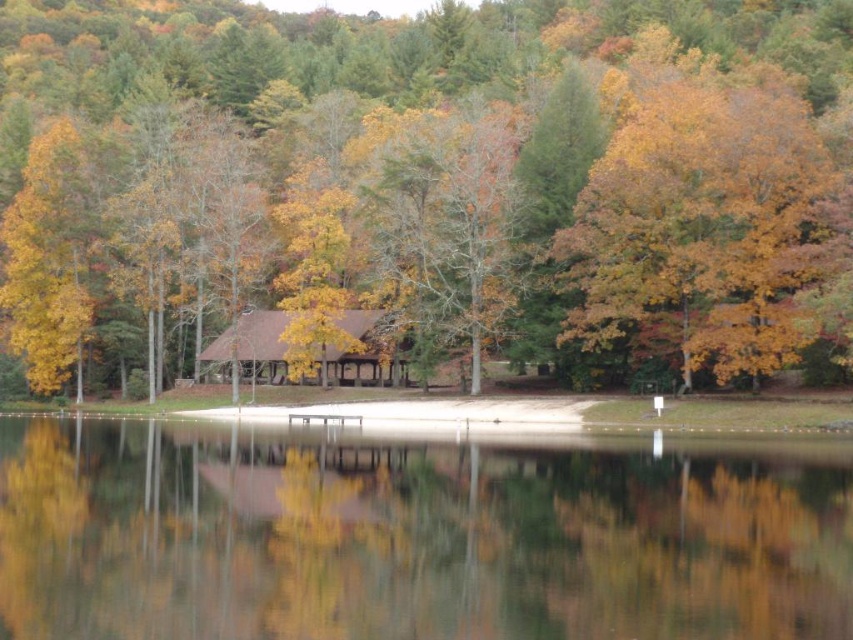
Question: Can you confirm if yellow matte tree at center is smaller than brown wooden cabin at center?

Choices:
 (A) no
 (B) yes

Answer: (A)

Question: Which object appears farthest from the camera in this image?

Choices:
 (A) yellow matte tree at center
 (B) transparent glass water at center
 (C) golden yellow leaves at upper right

Answer: (C)

Question: Which point is farther from the camera taking this photo?

Choices:
 (A) (334, 83)
 (B) (321, 541)
 (C) (756, 364)
 (D) (277, 323)

Answer: (A)

Question: Which point is farther to the camera?

Choices:
 (A) (83, 200)
 (B) (627, 499)
 (C) (662, 228)

Answer: (A)

Question: From the image, what is the correct spatial relationship of yellow matte tree at center in relation to transparent glass water at center?

Choices:
 (A) left
 (B) right

Answer: (A)

Question: Is yellow matte tree at center in front of golden yellow leaves at upper right?

Choices:
 (A) yes
 (B) no

Answer: (A)